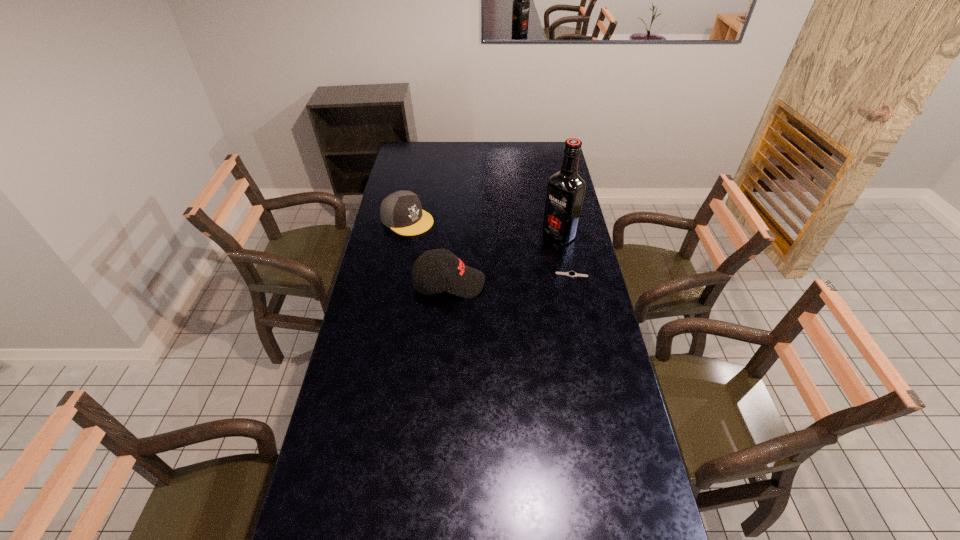
The image size is (960, 540). I want to click on baseball cap, so click(458, 279).

This screenshot has height=540, width=960. I want to click on the shortest object, so click(x=571, y=273).

In order to click on liquor in this screenshot , I will do `click(565, 193)`.

This screenshot has width=960, height=540. In order to click on cap in this screenshot , I will do `click(401, 211)`.

I want to click on vacant space situated on the front-facing side of the baseball cap, so click(528, 283).

This screenshot has width=960, height=540. I want to click on vacant point located on the back of the shortest object, so click(568, 257).

The height and width of the screenshot is (540, 960). Identify the location of vacant space located on the front-facing side of the tallest object. (509, 271).

Image resolution: width=960 pixels, height=540 pixels. I want to click on vacant space situated on the front-facing side of the tallest object, so click(x=516, y=266).

Where is `vacant space situated on the front-facing side of the tallest object`? This screenshot has height=540, width=960. vacant space situated on the front-facing side of the tallest object is located at coordinates (528, 256).

Image resolution: width=960 pixels, height=540 pixels. I want to click on free location located 0.300m on the front-facing side of the cap, so click(x=476, y=260).